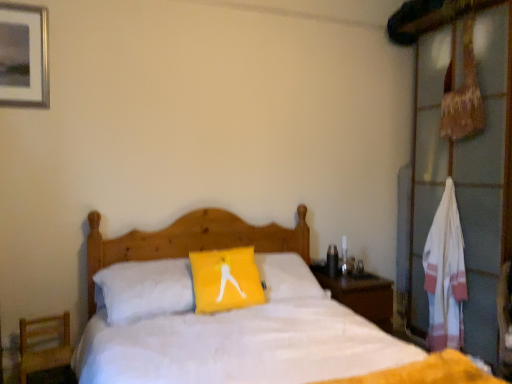
Question: Is wooden nightstand at right positioned behind metallic silver picture frame at upper left?

Choices:
 (A) yes
 (B) no

Answer: (A)

Question: Is wooden nightstand at right closer to the viewer compared to metallic silver picture frame at upper left?

Choices:
 (A) yes
 (B) no

Answer: (B)

Question: From a real-world perspective, is wooden nightstand at right physically above metallic silver picture frame at upper left?

Choices:
 (A) yes
 (B) no

Answer: (B)

Question: Does wooden nightstand at right have a lesser width compared to metallic silver picture frame at upper left?

Choices:
 (A) yes
 (B) no

Answer: (B)

Question: Can you see wooden nightstand at right touching metallic silver picture frame at upper left?

Choices:
 (A) no
 (B) yes

Answer: (A)

Question: In terms of width, does wooden bed at center look wider or thinner when compared to white striped towel at right?

Choices:
 (A) thin
 (B) wide

Answer: (B)

Question: Is wooden bed at center bigger or smaller than white striped towel at right?

Choices:
 (A) small
 (B) big

Answer: (B)

Question: In the image, is wooden bed at center positioned in front of or behind white striped towel at right?

Choices:
 (A) behind
 (B) front

Answer: (B)

Question: From a real-world perspective, is wooden bed at center positioned above or below white striped towel at right?

Choices:
 (A) above
 (B) below

Answer: (B)

Question: Is wooden nightstand at right in front of or behind wooden chair at lower left in the image?

Choices:
 (A) behind
 (B) front

Answer: (A)

Question: From a real-world perspective, relative to wooden chair at lower left, is wooden nightstand at right vertically above or below?

Choices:
 (A) above
 (B) below

Answer: (A)

Question: Considering the positions of point (373, 289) and point (50, 342), is point (373, 289) closer or farther from the camera than point (50, 342)?

Choices:
 (A) farther
 (B) closer

Answer: (A)

Question: In terms of size, does wooden nightstand at right appear bigger or smaller than wooden chair at lower left?

Choices:
 (A) small
 (B) big

Answer: (B)

Question: Relative to metallic silver picture frame at upper left, is white striped towel at right in front or behind?

Choices:
 (A) front
 (B) behind

Answer: (B)

Question: In terms of size, does white striped towel at right appear bigger or smaller than metallic silver picture frame at upper left?

Choices:
 (A) big
 (B) small

Answer: (A)